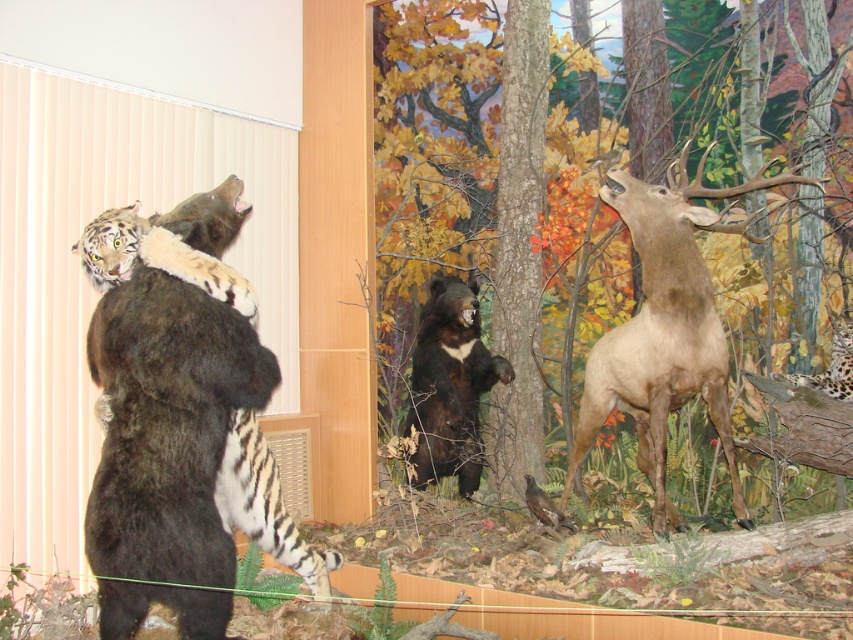
Can you confirm if brown wood tree at center is positioned below brown fur bear at left?

Incorrect, brown wood tree at center is not positioned below brown fur bear at left.

This screenshot has width=853, height=640. Describe the element at coordinates (431, 156) in the screenshot. I see `brown wood tree at center` at that location.

Is point (384, 120) positioned after point (306, 563)?

Yes, point (384, 120) is farther from viewer.

You are a GUI agent. You are given a task and a screenshot of the screen. Output one action in this format:
    pyautogui.click(x=<x>, y=<y>)
    Task: Click on the brown wood tree at center
    This screenshot has height=640, width=853.
    Given the screenshot: What is the action you would take?
    [x=431, y=156]

Is brown matte/deer at right further to the viewer compared to black fur bear at center?

That is False.

Who is taller, brown matte/deer at right or black fur bear at center?

Standing taller between the two is brown matte/deer at right.

Which is behind, point (613, 339) or point (444, 342)?

Point (444, 342)

Locate an element on the screen. Image resolution: width=853 pixels, height=640 pixels. brown matte/deer at right is located at coordinates (664, 333).

From the picture: Which is more to the left, brown wood tree at center or black fur bear at center?

black fur bear at center

Between point (585, 172) and point (428, 460), which one is positioned in front?

Point (428, 460) is more forward.

Identify the location of brown wood tree at center. (431, 156).